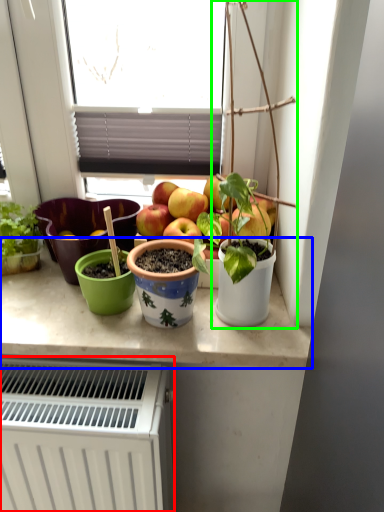
Question: Which object is positioned closest to radiator (highlighted by a red box)? Select from counter top (highlighted by a blue box) and houseplant (highlighted by a green box).

Choices:
 (A) counter top
 (B) houseplant

Answer: (A)